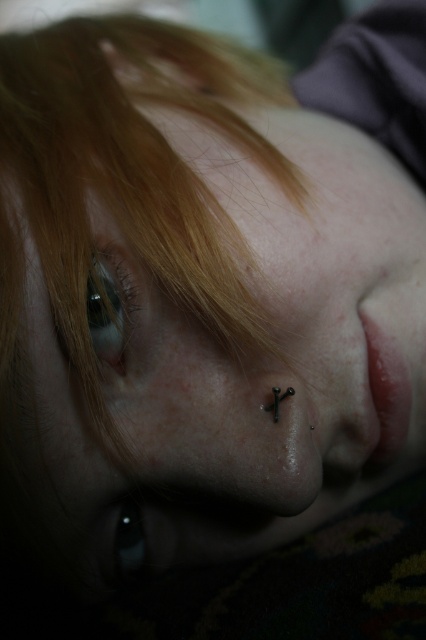
Question: Among these objects, which one is nearest to the camera?

Choices:
 (A) matte black eye at upper left
 (B) black glossy eye at lower left

Answer: (A)

Question: Can you confirm if matte black eye at upper left is positioned below black glossy eye at lower left?

Choices:
 (A) yes
 (B) no

Answer: (B)

Question: Which of the following is the farthest from the observer?

Choices:
 (A) matte black eye at upper left
 (B) black glossy eye at lower left

Answer: (B)

Question: Can you confirm if matte black eye at upper left is positioned to the right of black glossy eye at lower left?

Choices:
 (A) yes
 (B) no

Answer: (A)

Question: Can you confirm if matte black eye at upper left is positioned below black glossy eye at lower left?

Choices:
 (A) no
 (B) yes

Answer: (A)